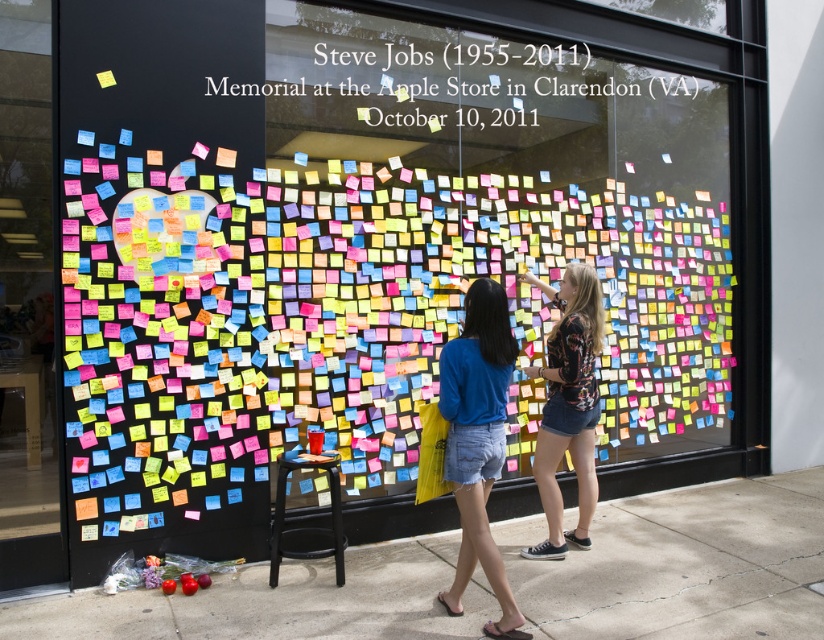
You are a visitor at the memorial and want to sit down to write a note. Is the black matte stool at lower center located behind or in front of the floral print shirt at center?

The black matte stool at lower center is behind the floral print shirt at center.